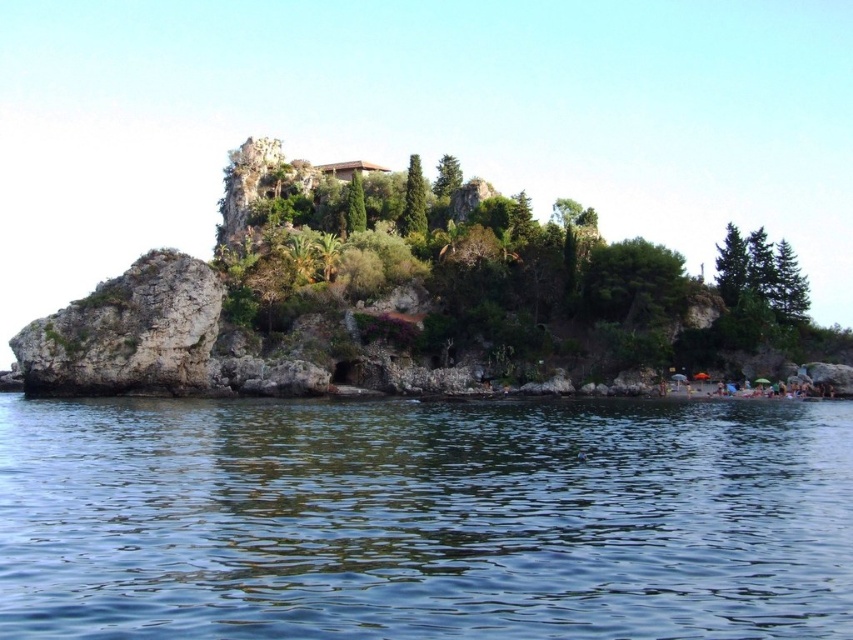
Question: Is clear blue water at lower center wider than rocky cliff at left?

Choices:
 (A) no
 (B) yes

Answer: (B)

Question: Which point appears farthest from the camera in this image?

Choices:
 (A) (340, 572)
 (B) (175, 300)

Answer: (B)

Question: Is clear blue water at lower center positioned in front of rocky cliff at left?

Choices:
 (A) yes
 (B) no

Answer: (A)

Question: Can you confirm if clear blue water at lower center is positioned to the right of rocky cliff at left?

Choices:
 (A) yes
 (B) no

Answer: (A)